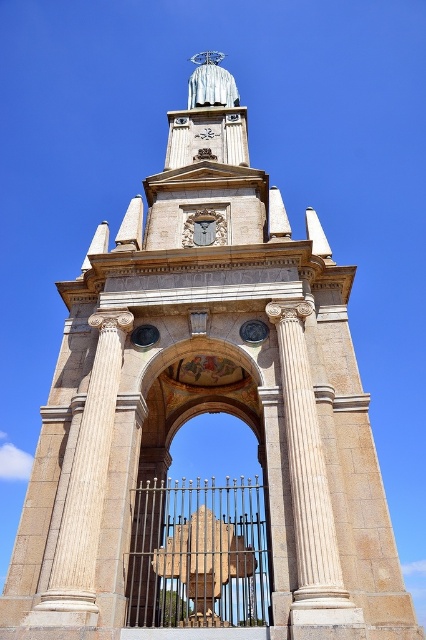
Question: Is gold textured gate at center smaller than white marble column at center?

Choices:
 (A) no
 (B) yes

Answer: (A)

Question: Which point is closer to the camera taking this photo?

Choices:
 (A) (187, 566)
 (B) (140, 548)
 (C) (322, 531)

Answer: (C)

Question: Is gold textured gate at center smaller than white marble column at center?

Choices:
 (A) yes
 (B) no

Answer: (B)

Question: Can you confirm if gold textured gate at center is positioned to the right of wooden carving at center?

Choices:
 (A) yes
 (B) no

Answer: (A)

Question: Which of the following is the farthest from the observer?

Choices:
 (A) white marble column at center
 (B) wooden carving at center

Answer: (B)

Question: Which object is the farthest from the white marble column at center?

Choices:
 (A) gold textured gate at center
 (B) wooden carving at center

Answer: (A)